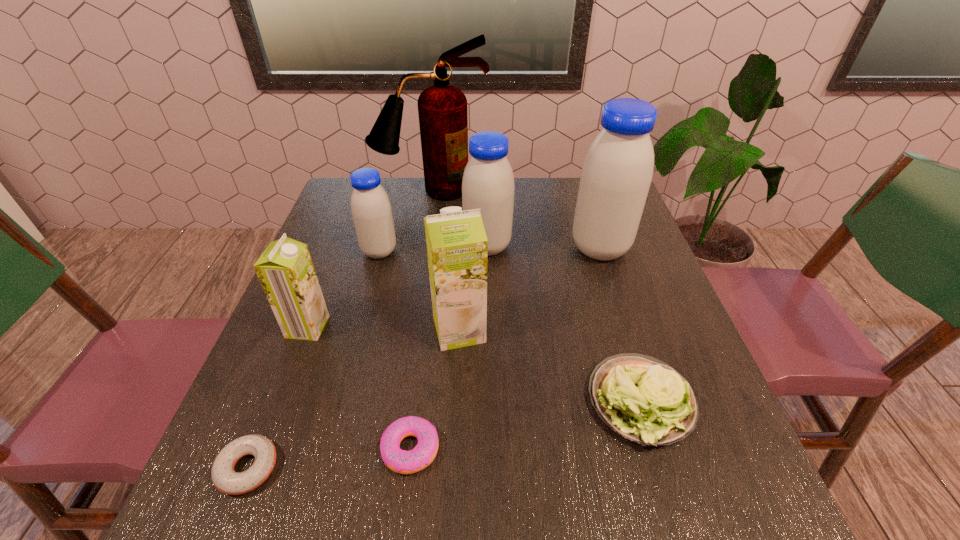
The width and height of the screenshot is (960, 540). What are the coordinates of `green lettuce` in the screenshot? It's located at (641, 398).

In order to click on lettuce in this screenshot , I will do `click(641, 398)`.

Where is `the right doughnut`? The height and width of the screenshot is (540, 960). the right doughnut is located at coordinates (400, 461).

Where is `the left doughnut`? the left doughnut is located at coordinates (225, 479).

Locate an element on the screen. This screenshot has width=960, height=540. vacant region located 0.170m at the nozzle of the fire extinguisher is located at coordinates (424, 235).

Locate an element on the screen. This screenshot has width=960, height=540. free space located 0.190m on the back of the second tallest object is located at coordinates (582, 194).

You are a GUI agent. You are given a task and a screenshot of the screen. Output one action in this format:
    pyautogui.click(x=<x>, y=<y>)
    Task: Click on the vacant area situated on the left of the second biggest blue soya milk
    
    Given the screenshot: What is the action you would take?
    tap(380, 246)

The image size is (960, 540). In order to click on vacant space located 0.330m on the front of the right green soya milk in this screenshot , I will do `click(450, 526)`.

In order to click on free spot located 0.230m on the front of the left green soya milk in this screenshot , I will do `click(262, 445)`.

This screenshot has width=960, height=540. In order to click on vacant space situated 0.240m on the front of the second soya milk from left to right in this screenshot , I will do `click(356, 336)`.